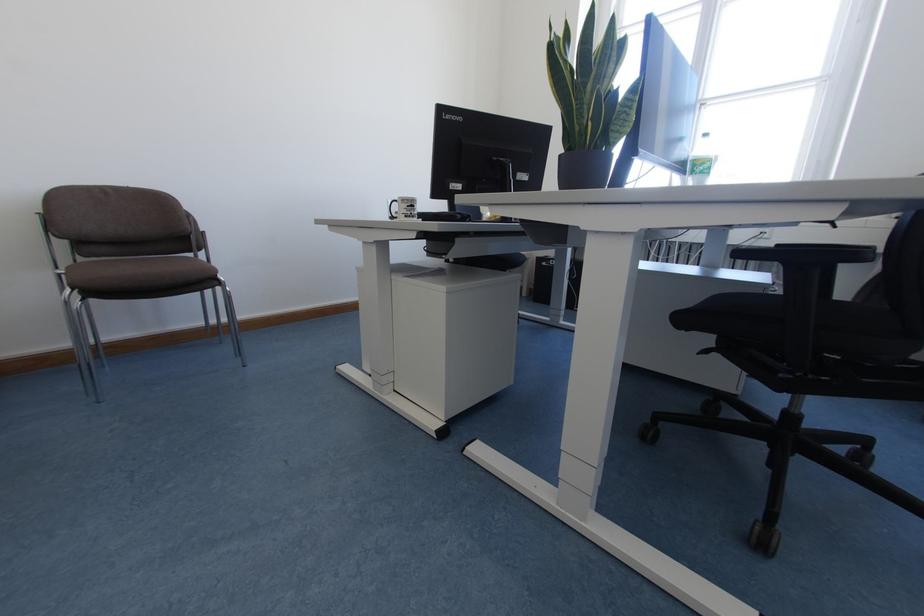
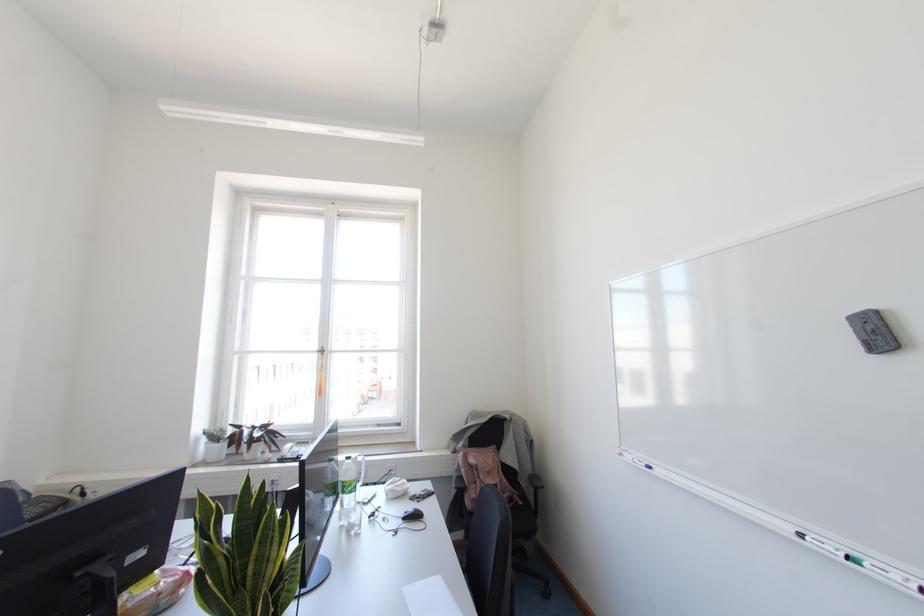
The point at [694,164] is marked in the first image. Where is the corresponding point in the second image?

(343, 485)